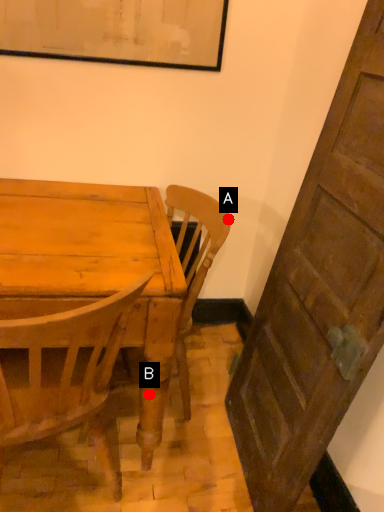
Question: Two points are circled on the image, labeled by A and B beside each circle. Which point is closer to the camera?

Choices:
 (A) A is closer
 (B) B is closer

Answer: (B)